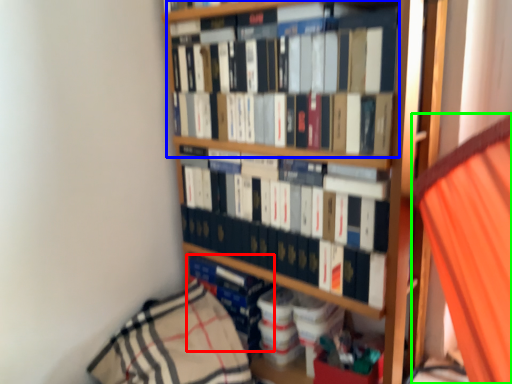
Question: Which object is the farthest from book (highlighted by a red box)? Choose among these: book (highlighted by a blue box) or curtain (highlighted by a green box).

Choices:
 (A) book
 (B) curtain

Answer: (B)